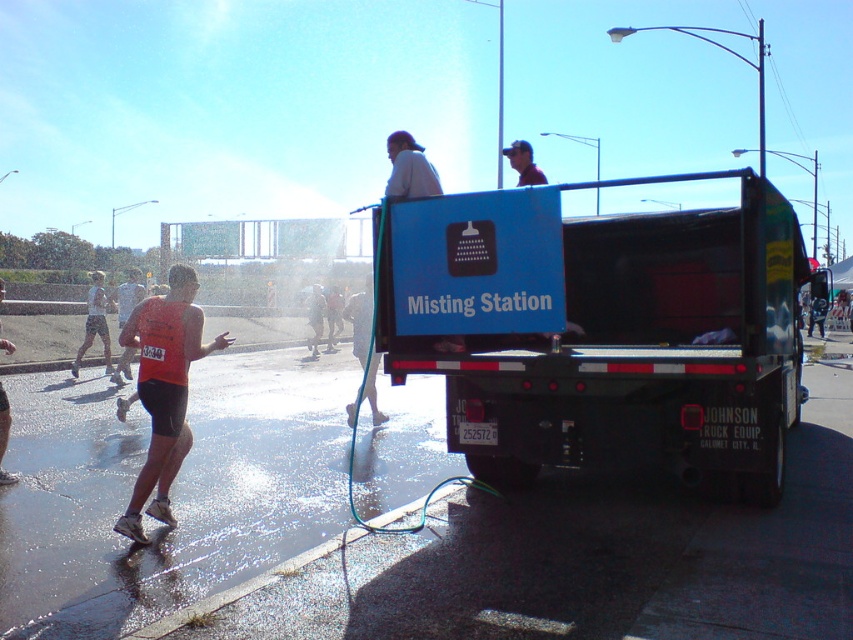
Question: Can you confirm if orange fabric shorts at left is positioned below orange tank top at left?

Choices:
 (A) yes
 (B) no

Answer: (B)

Question: Among these points, which one is nearest to the camera?

Choices:
 (A) (518, 362)
 (B) (160, 324)
 (C) (4, 404)

Answer: (A)

Question: Is white athletic shorts at left further to the viewer compared to orange tank top at left?

Choices:
 (A) no
 (B) yes

Answer: (B)

Question: Observing the image, what is the correct spatial positioning of blue matte truck at upper center in reference to orange fabric shorts at left?

Choices:
 (A) below
 (B) above

Answer: (B)

Question: Which of these objects is positioned farthest from the orange tank top at left?

Choices:
 (A) orange fabric shorts at left
 (B) blue matte truck at upper center

Answer: (B)

Question: Among these points, which one is farthest from the camera?

Choices:
 (A) (4, 481)
 (B) (683, 276)

Answer: (B)